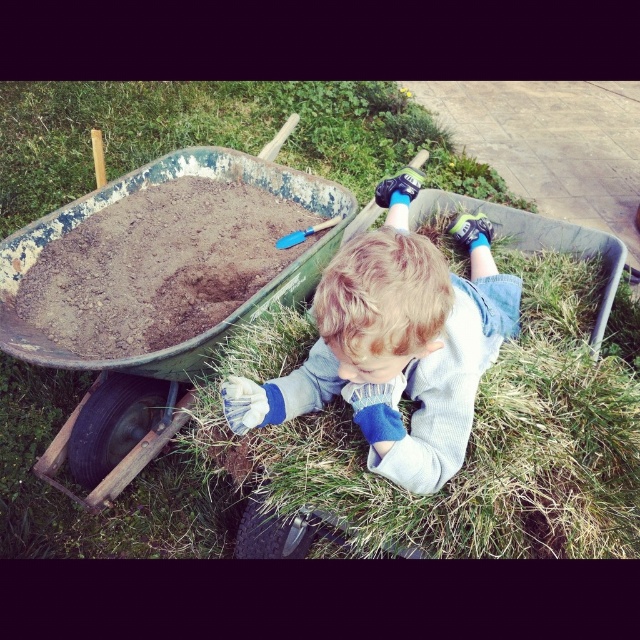
Question: Can you confirm if light blue denim pants at lower center is positioned to the left of brown gravel at center?

Choices:
 (A) yes
 (B) no

Answer: (B)

Question: Considering the relative positions of green grass at center and light blue denim pants at lower center in the image provided, where is green grass at center located with respect to light blue denim pants at lower center?

Choices:
 (A) above
 (B) below

Answer: (A)

Question: Estimate the real-world distances between objects in this image. Which object is farther from the rusty metal wheelbarrow at left?

Choices:
 (A) green grass at center
 (B) light blue denim pants at lower center

Answer: (A)

Question: Which point is closer to the camera?

Choices:
 (A) (284, 534)
 (B) (160, 394)

Answer: (A)

Question: Does green grass at center appear on the right side of light blue denim pants at lower center?

Choices:
 (A) no
 (B) yes

Answer: (A)

Question: Based on their relative distances, which object is farther from the light blue denim pants at lower center?

Choices:
 (A) blue denim jeans at lower center
 (B) brown gravel at center
 (C) green grass at center

Answer: (C)